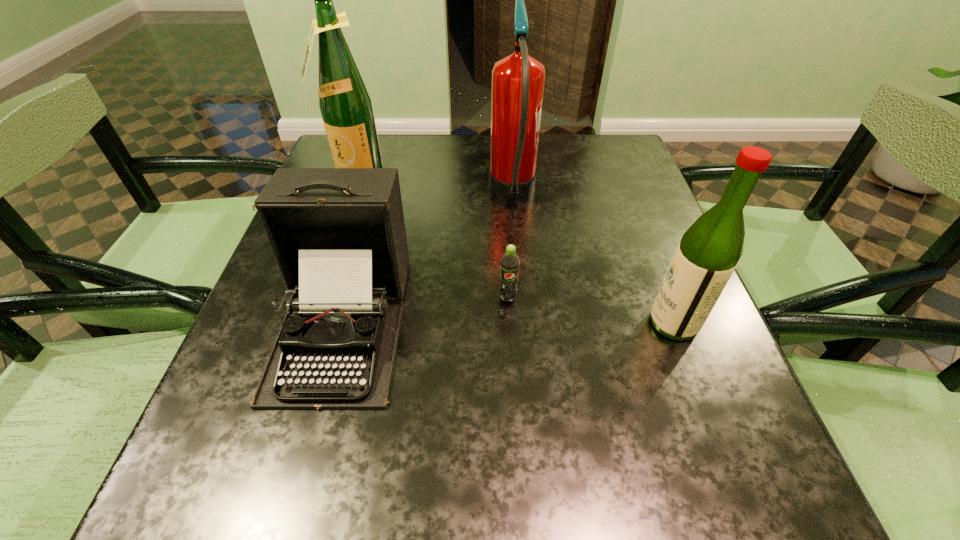
This screenshot has width=960, height=540. I want to click on vacant area situated on the label of the right liquor, so click(x=558, y=323).

Find the location of a particular element. vacant space situated on the label of the right liquor is located at coordinates (461, 323).

Where is `free region located 0.120m inside the open case of the second shortest object`? This screenshot has width=960, height=540. free region located 0.120m inside the open case of the second shortest object is located at coordinates (295, 497).

You are a GUI agent. You are given a task and a screenshot of the screen. Output one action in this format:
    pyautogui.click(x=<x>, y=<y>)
    Task: Click on the free space located on the front label of the shortest object
    The height and width of the screenshot is (540, 960).
    Given the screenshot: What is the action you would take?
    pyautogui.click(x=513, y=378)

Where is `liquor positioned at the far edge`? The image size is (960, 540). liquor positioned at the far edge is located at coordinates point(345,104).

The image size is (960, 540). I want to click on fire extinguisher that is at the far edge, so click(518, 79).

This screenshot has width=960, height=540. Find the location of `liquor present at the left edge`. liquor present at the left edge is located at coordinates (345, 104).

Find the location of `typewriter positioned at the left edge`. typewriter positioned at the left edge is located at coordinates (338, 235).

The width and height of the screenshot is (960, 540). I want to click on object at the right edge, so click(x=709, y=251).

Image resolution: width=960 pixels, height=540 pixels. Find the location of `object present at the far left corner`. object present at the far left corner is located at coordinates (345, 104).